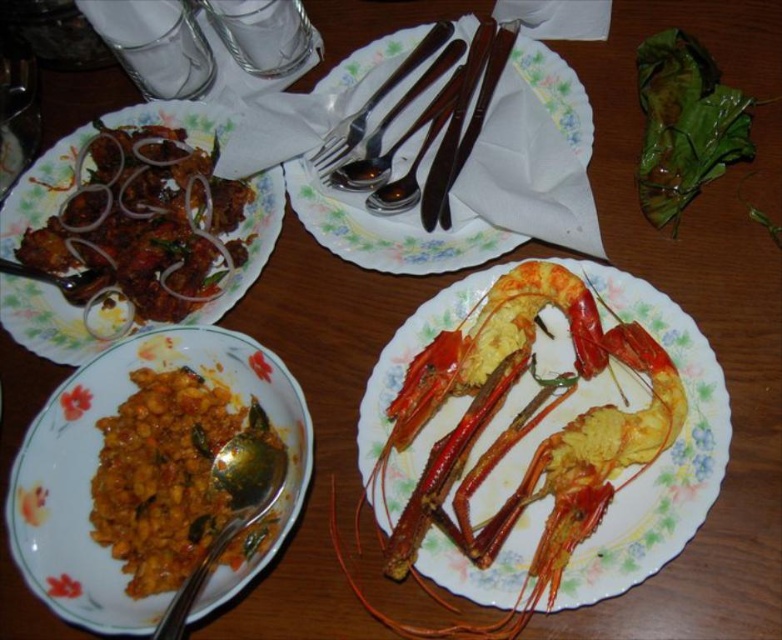
Question: Which point is closer to the camera?

Choices:
 (A) (381, 131)
 (B) (246, 580)
 (C) (551, 342)
 (D) (192, 577)

Answer: (B)

Question: Which object is closer to the camera taking this photo?

Choices:
 (A) brown matte curry at lower left
 (B) matte brown meat at left

Answer: (A)

Question: Considering the real-world distances, which object is farthest from the matte brown meat at left?

Choices:
 (A) brown matte curry at lower left
 (B) satin silver fork at upper center
 (C) golden fried prawns at center

Answer: (C)

Question: Is matte brown meat at left wider than satin silver fork at upper center?

Choices:
 (A) yes
 (B) no

Answer: (A)

Question: Is yellowish matte curry at lower left to the left of metallic silverware at center from the viewer's perspective?

Choices:
 (A) no
 (B) yes

Answer: (B)

Question: Can you confirm if matte brown meat at left is smaller than spoon at lower left?

Choices:
 (A) yes
 (B) no

Answer: (B)